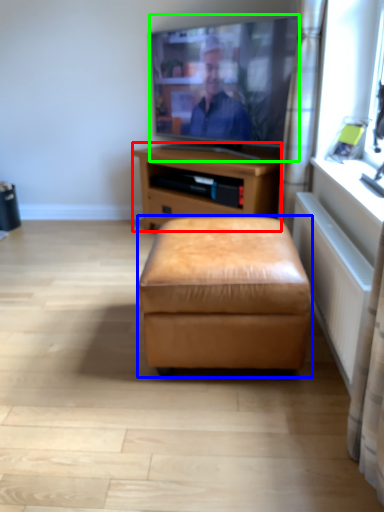
Question: Which object is the closest to the nightstand (highlighted by a red box)? Choose among these: stool (highlighted by a blue box) or television (highlighted by a green box).

Choices:
 (A) stool
 (B) television

Answer: (B)